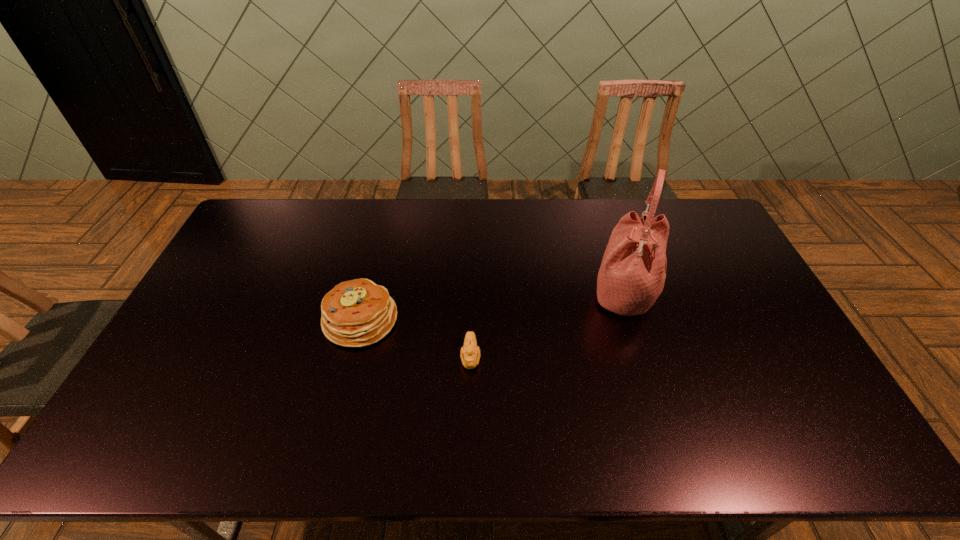
This screenshot has height=540, width=960. What are the coordinates of `the rightmost object` in the screenshot? It's located at (632, 274).

At what (x,y) coordinates should I click in order to perform the action: click on handbag. Please return your answer as a coordinate pair (x, y). This screenshot has height=540, width=960. Looking at the image, I should click on (632, 274).

At what (x,y) coordinates should I click in order to perform the action: click on the second tallest object. Please return your answer as a coordinate pair (x, y). The height and width of the screenshot is (540, 960). Looking at the image, I should click on (356, 313).

Locate an element on the screen. The height and width of the screenshot is (540, 960). pancake is located at coordinates (356, 313).

You are a GUI agent. You are given a task and a screenshot of the screen. Output one action in this format:
    pyautogui.click(x=<x>, y=<y>)
    Task: Click on the shortest object
    
    Given the screenshot: What is the action you would take?
    pyautogui.click(x=470, y=354)

The width and height of the screenshot is (960, 540). In order to click on duckling in this screenshot , I will do (470, 354).

Find the location of `free point located on the front of the tallest object`. free point located on the front of the tallest object is located at coordinates (638, 340).

What are the coordinates of `free location located on the left of the pancake` in the screenshot? It's located at (280, 320).

This screenshot has width=960, height=540. What are the coordinates of `vacant region located 0.050m on the face of the duckling` in the screenshot? It's located at (470, 391).

Locate an element on the screen. The width and height of the screenshot is (960, 540). free space at the far edge of the desktop is located at coordinates (363, 226).